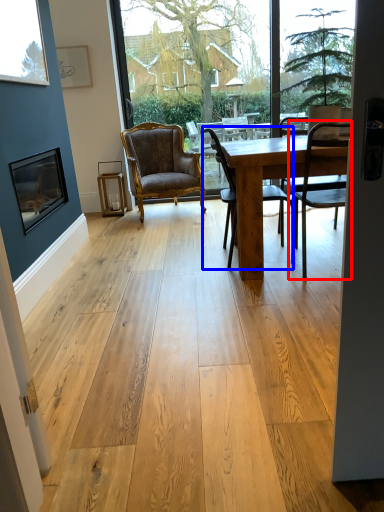
Question: Which point is further to the camera, chair (highlighted by a red box) or chair (highlighted by a blue box)?

Choices:
 (A) chair
 (B) chair

Answer: (B)